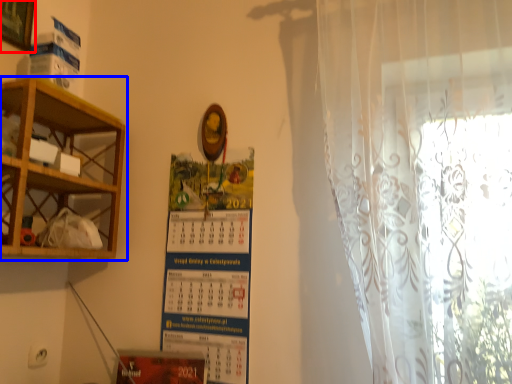
Question: Which object is closer to the camera taking this photo, picture frame (highlighted by a red box) or shelf (highlighted by a blue box)?

Choices:
 (A) picture frame
 (B) shelf

Answer: (B)